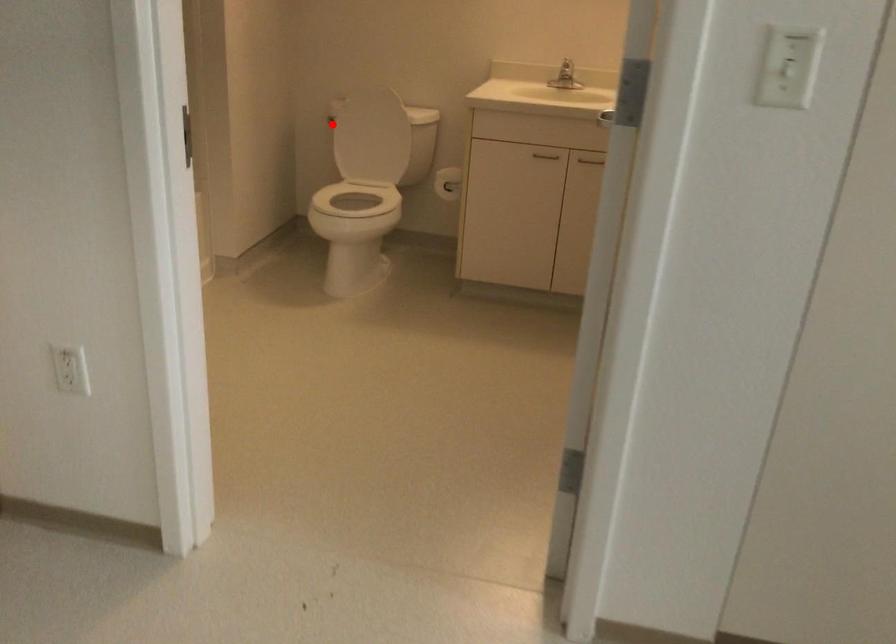
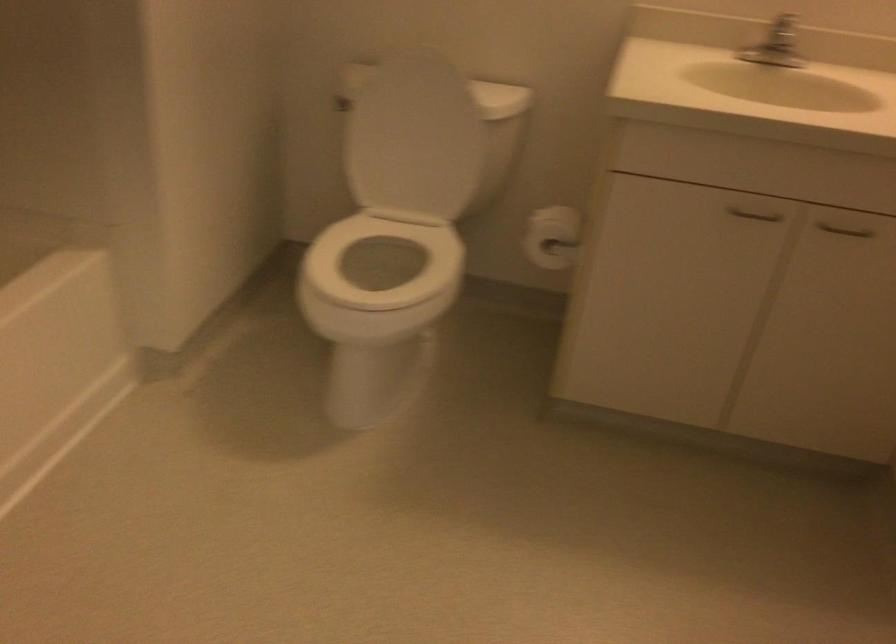
Find the pixel in the second image that matches the highlighted location in the first image.

(340, 104)